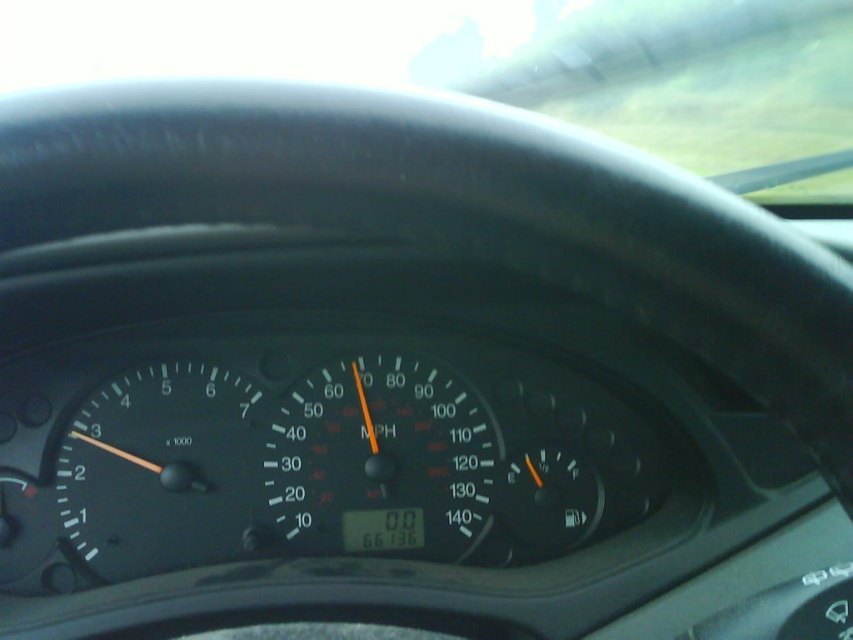
You are a driver looking at the dashboard. Where is the transparent glass windshield at upper center located in terms of its 2D coordinates?

The transparent glass windshield at upper center is located at the 2D coordinates of point (498, 60).

You are a passenger in the car and want to know if you can safely reach the transparent glass windshield at upper center from your current position. Your arm can extend up to 1.5 meters. Can you reach it?

The transparent glass windshield at upper center is 6.00 meters away from the camera, which is much farther than your arm can reach. You cannot safely reach it.